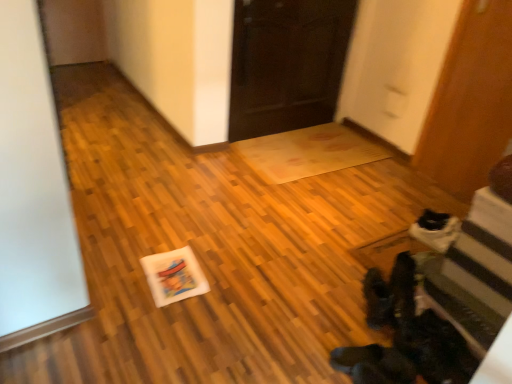
At what (x,y) coordinates should I click in order to perform the action: click on free space in front of wooden door at right, which ranks as the second door in left-to-right order. Please return your answer as a coordinate pair (x, y). The image size is (512, 384). Looking at the image, I should click on (446, 205).